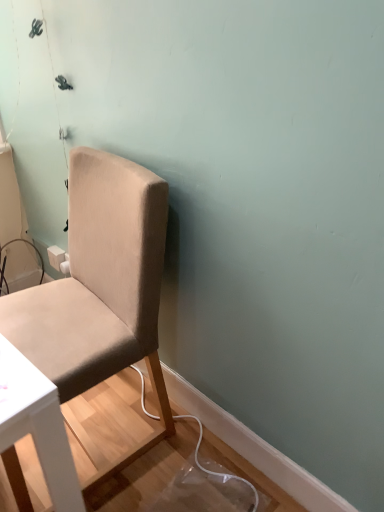
Image resolution: width=384 pixels, height=512 pixels. Find the location of `beige fabric chair at left`. beige fabric chair at left is located at coordinates (100, 287).

Describe the element at coordinates (100, 287) in the screenshot. The height and width of the screenshot is (512, 384). I see `beige fabric chair at left` at that location.

Locate an element on the screen. The width and height of the screenshot is (384, 512). beige fabric chair at left is located at coordinates (100, 287).